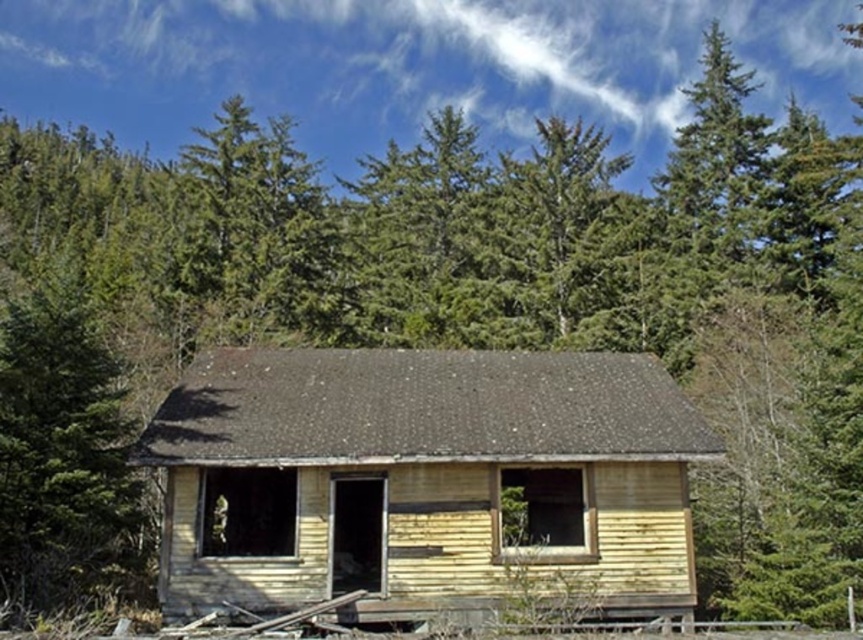
Can you confirm if yellow wood cabin at center is positioned below green textured tree at left?

Yes.

How distant is yellow wood cabin at center from green textured tree at left?

They are 5.76 meters apart.

Between point (613, 612) and point (28, 316), which one is positioned behind?

The point (613, 612) is behind.

Locate an element on the screen. This screenshot has width=863, height=640. yellow wood cabin at center is located at coordinates (425, 483).